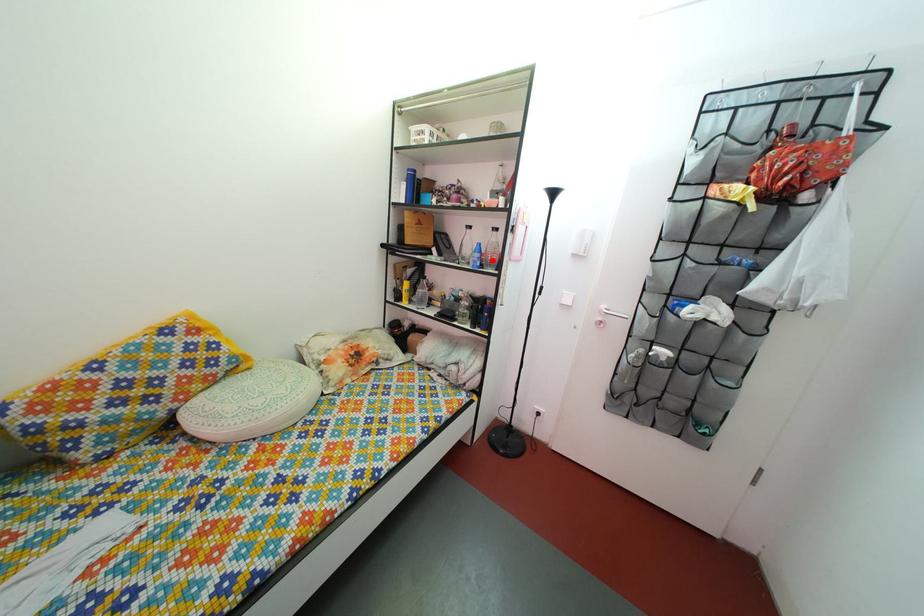
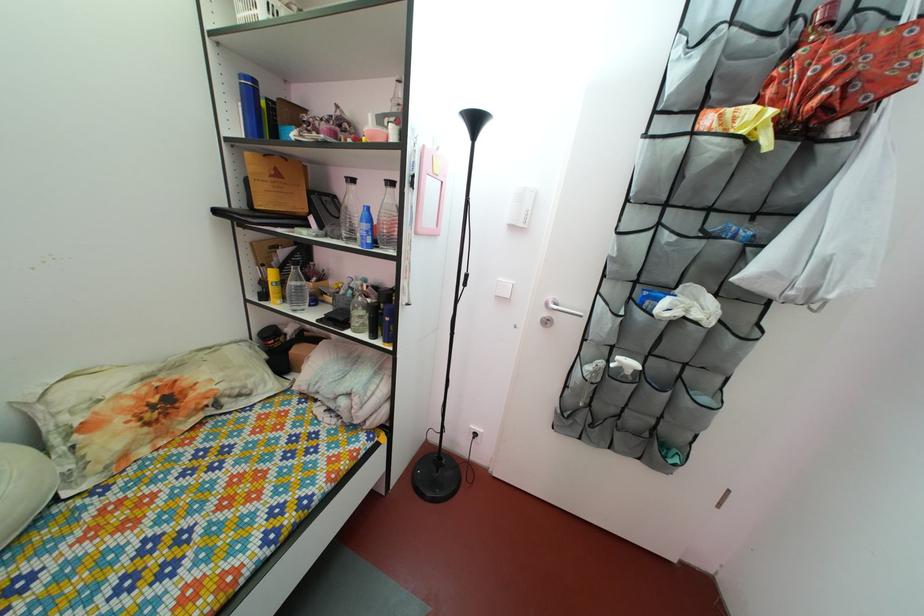
Where in the second image is the point corresponding to the highlighted location from the first image?

(383, 230)